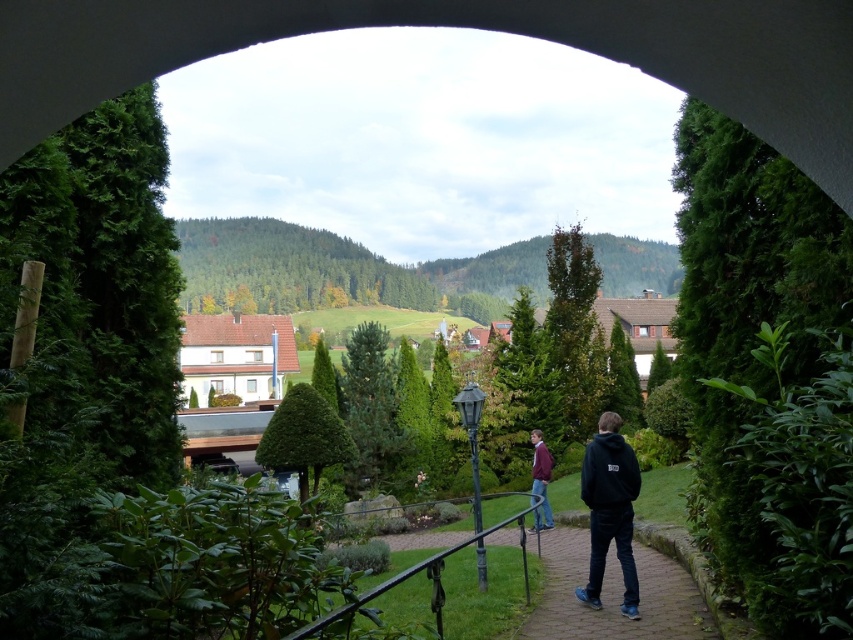
You are standing at the arched opening looking out into the garden. There is a black hoodie at center. Where exactly is the black hoodie located in terms of coordinates?

The black hoodie at center is located at coordinates point (608, 509).

You are standing at the arched opening looking out into the garden. There is a black metal railing along the path and two people walking away from you towards the center. Where is the point at coordinates [608,509] located?

The point at coordinates [608,509] is located on the black hoodie at center.